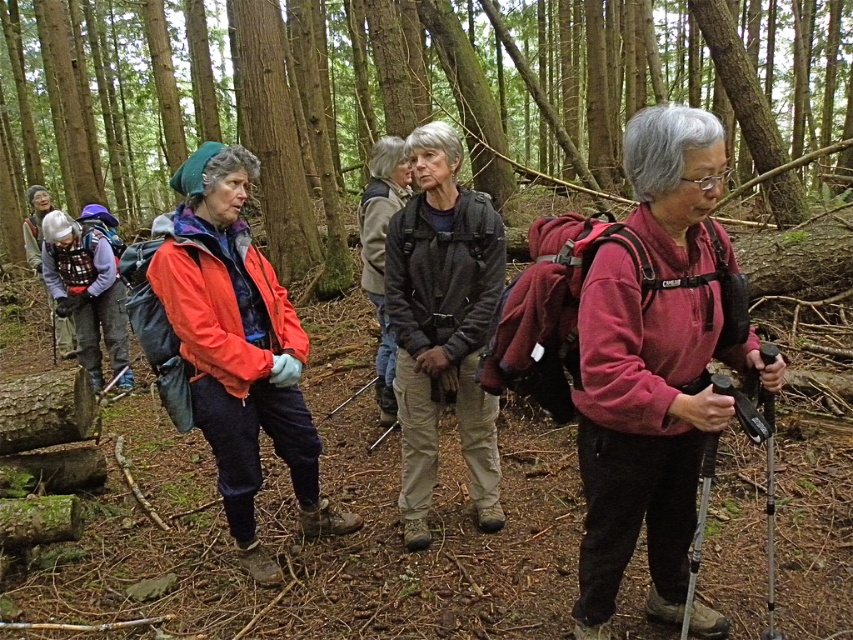
Question: Based on their relative distances, which object is farther from the dark gray textured jacket at center?

Choices:
 (A) matte orange jacket at center
 (B) matte pink sweater at center

Answer: (B)

Question: Does brown wood tree at center appear under dark gray textured jacket at center?

Choices:
 (A) yes
 (B) no

Answer: (B)

Question: Which object is the closest to the matte orange jacket at center?

Choices:
 (A) dark gray textured jacket at center
 (B) matte pink sweater at center
 (C) brown wood tree at center

Answer: (A)

Question: Observing the image, what is the correct spatial positioning of matte pink sweater at center in reference to matte orange jacket at center?

Choices:
 (A) left
 (B) right

Answer: (B)

Question: Which of the following is the farthest from the observer?

Choices:
 (A) brown wood tree at center
 (B) dark gray textured jacket at center
 (C) matte pink sweater at center
 (D) matte orange jacket at center

Answer: (A)

Question: From the image, what is the correct spatial relationship of matte pink sweater at center in relation to dark gray textured jacket at center?

Choices:
 (A) above
 (B) below

Answer: (B)